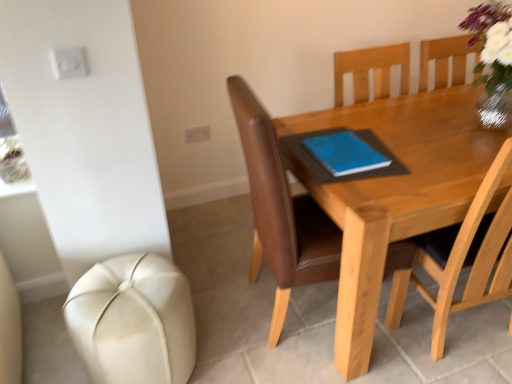
Question: Considering the positions of point (358, 105) and point (125, 301), is point (358, 105) closer or farther from the camera than point (125, 301)?

Choices:
 (A) closer
 (B) farther

Answer: (B)

Question: Is wooden table at center wider or thinner than white leather ottoman at lower left?

Choices:
 (A) thin
 (B) wide

Answer: (B)

Question: Which of these objects is positioned closest to the white leather ottoman at lower left?

Choices:
 (A) wooden table at center
 (B) brown leather chair at center
 (C) blue matte notebook at center

Answer: (B)

Question: Considering the real-world distances, which object is closest to the white leather ottoman at lower left?

Choices:
 (A) blue matte notebook at center
 (B) wooden table at center
 (C) brown leather chair at center

Answer: (C)